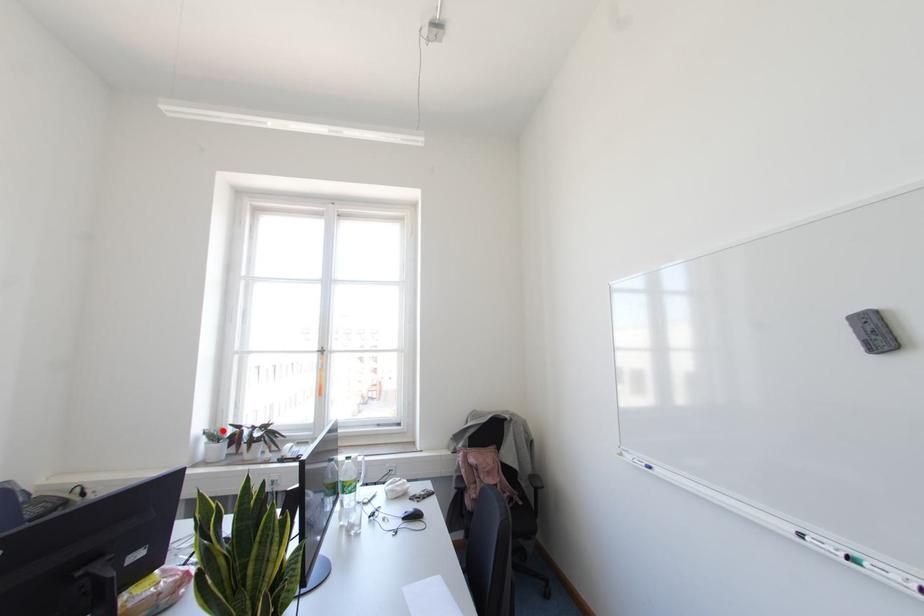
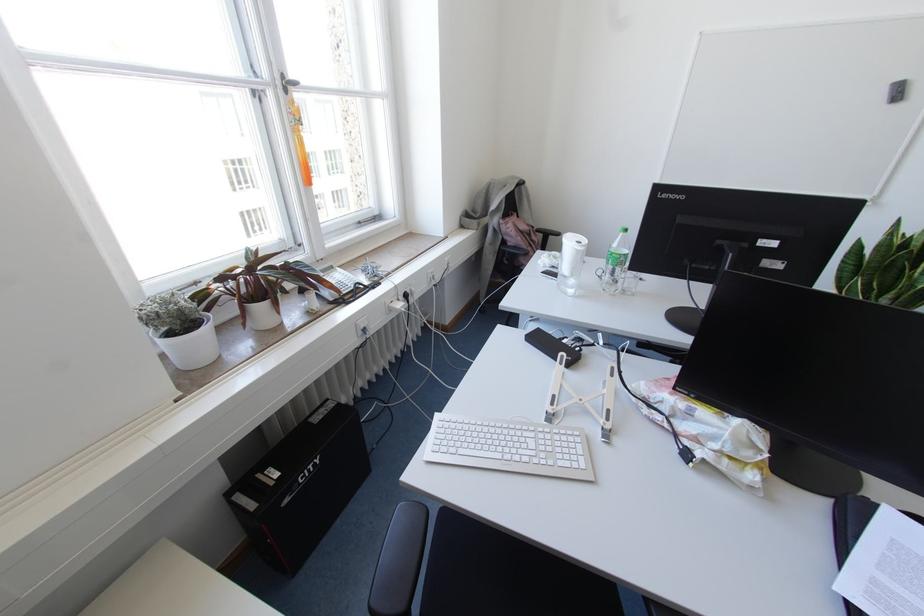
Where in the second image is the point corresponding to the highlighted location from the first image?

(186, 298)